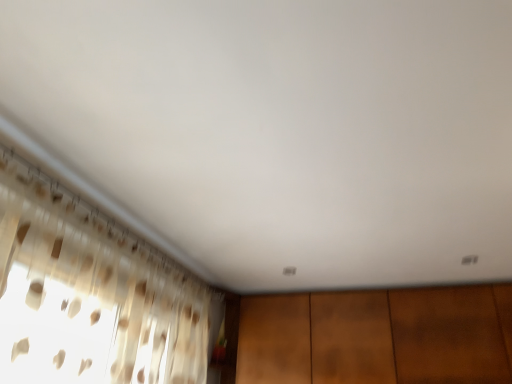
Question: Is point (46, 367) closer or farther from the camera than point (450, 319)?

Choices:
 (A) farther
 (B) closer

Answer: (B)

Question: From their relative heights in the image, would you say translucent fabric curtain at left is taller or shorter than brown wood dresser at lower center?

Choices:
 (A) tall
 (B) short

Answer: (A)

Question: In the image, is translucent fabric curtain at left positioned in front of or behind brown wood dresser at lower center?

Choices:
 (A) behind
 (B) front

Answer: (B)

Question: Relative to translucent fabric curtain at left, is brown wood dresser at lower center in front or behind?

Choices:
 (A) behind
 (B) front

Answer: (A)

Question: From the image's perspective, relative to translucent fabric curtain at left, is brown wood dresser at lower center above or below?

Choices:
 (A) below
 (B) above

Answer: (A)

Question: Considering the positions of point (272, 347) and point (166, 382), is point (272, 347) closer or farther from the camera than point (166, 382)?

Choices:
 (A) closer
 (B) farther

Answer: (B)

Question: Considering the positions of brown wood dresser at lower center and translucent fabric curtain at left in the image, is brown wood dresser at lower center wider or thinner than translucent fabric curtain at left?

Choices:
 (A) thin
 (B) wide

Answer: (B)